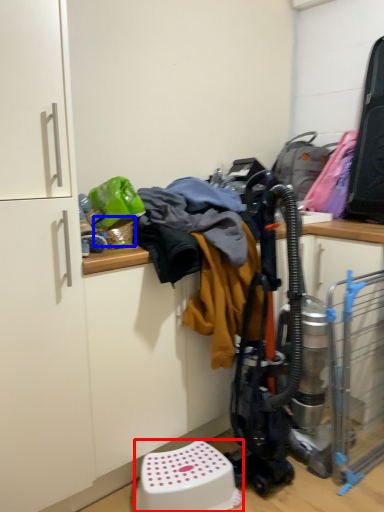
Question: Which point is closer to the camera, step stool (highlighted by a red box) or basket (highlighted by a blue box)?

Choices:
 (A) step stool
 (B) basket

Answer: (A)